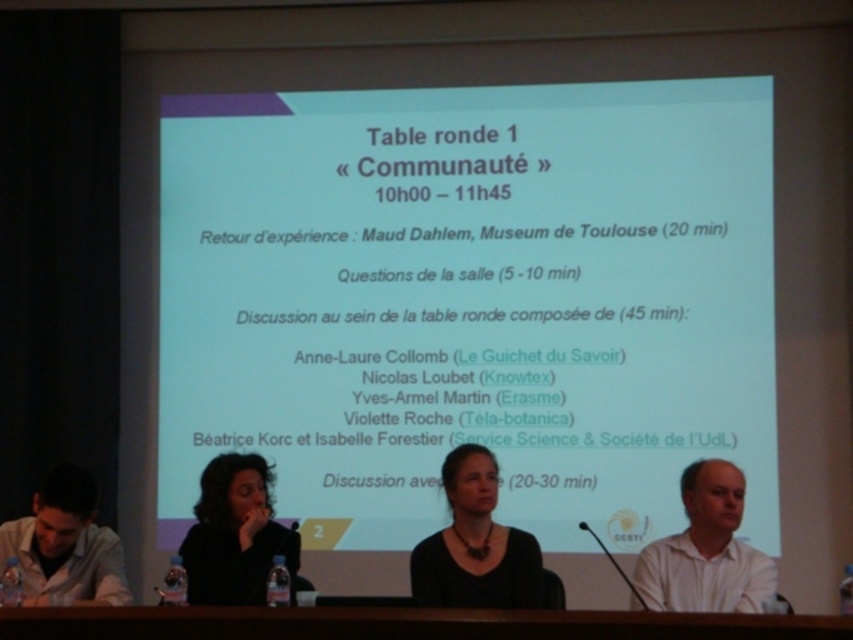
From the picture: You are attending a conference and want to take a photo of the panel discussion setup. The camera you have can focus on objects within 6 meters. Is the point at coordinates point (558,486) within the camera focus range?

The point (558,486) is 6.51 meters from the viewer, which is beyond the camera focus range of 6 meters. Therefore, the point is out of focus.

You are sitting at the back of the room and want to see both the white matte projector screen at upper center and the matte black necklace at center. Which object will appear closer to you?

The white matte projector screen at upper center will appear closer to you because it is further to the viewer than the matte black necklace at center.

Looking at this image, you are an event organizer who needs to ensure that the white matte projector screen at upper center and the matte white shirt at lower left are visible to all attendees. Considering their sizes, which object will be more easily seen from the back of the room?

The white matte projector screen at upper center is bigger than the matte white shirt at lower left, so it will be more easily seen from the back of the room.